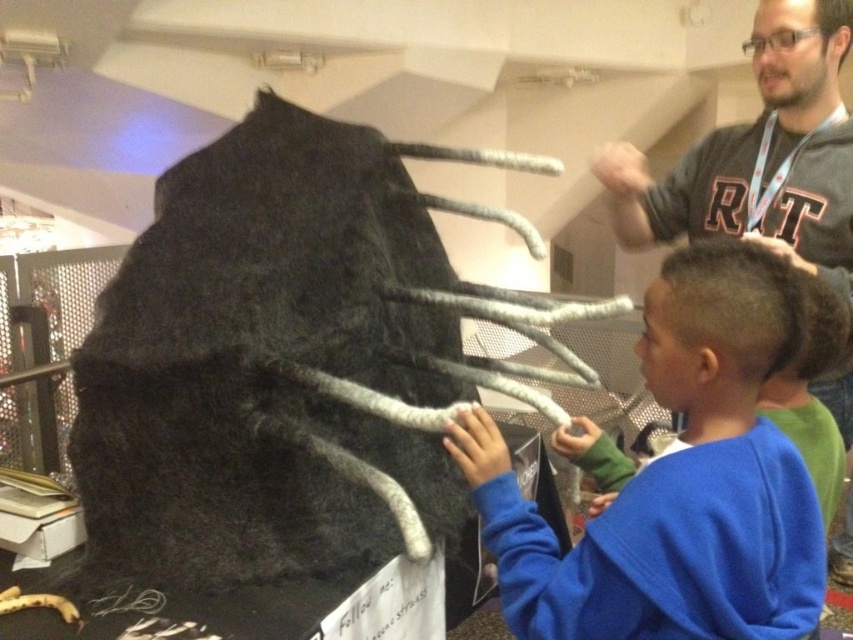
You are a museum guide at an interactive exhibit. Two visitors are standing near the fossil display. They are wearing a blue fleece sweater at center and a dark gray sweater at upper right. You need to ensure they maintain a 24 inch social distancing guideline. Based on the scene, are they complying with the rule?

The distance between the blue fleece sweater at center and the dark gray sweater at upper right is 24.65 inches, which exceeds the 24 inch social distancing guideline. Therefore, they are complying with the rule.

Where is the blue fleece sweater at center located in the image?

The blue fleece sweater at center is located at point coordinates of (676, 481).

You are a parent at an educational event and see your two children, one wearing a blue fleece sweater at center and the other in a dark gray sweater at upper right. Which child is shorter?

The blue fleece sweater at center is not as tall as dark gray sweater at upper right, so the child in the blue fleece sweater at center is shorter.